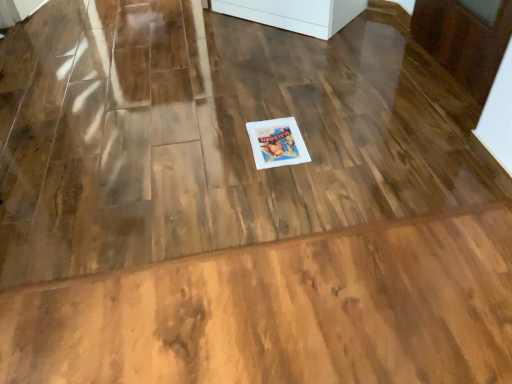
Where is `vacant space behind white glossy comic book at center`? The height and width of the screenshot is (384, 512). vacant space behind white glossy comic book at center is located at coordinates [x=269, y=105].